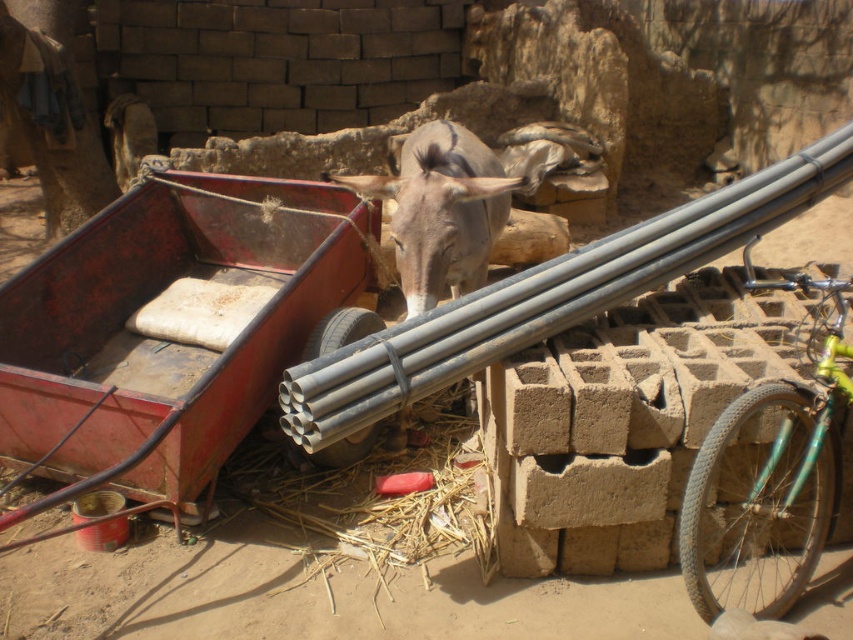
Consider the image. Which is above, green matte bicycle at right or gray matte donkey at center?

Positioned higher is gray matte donkey at center.

Is green matte bicycle at right wider than gray matte donkey at center?

Correct, the width of green matte bicycle at right exceeds that of gray matte donkey at center.

What do you see at coordinates (770, 467) in the screenshot?
I see `green matte bicycle at right` at bounding box center [770, 467].

At what (x,y) coordinates should I click in order to perform the action: click on green matte bicycle at right. Please return your answer as a coordinate pair (x, y). Looking at the image, I should click on (770, 467).